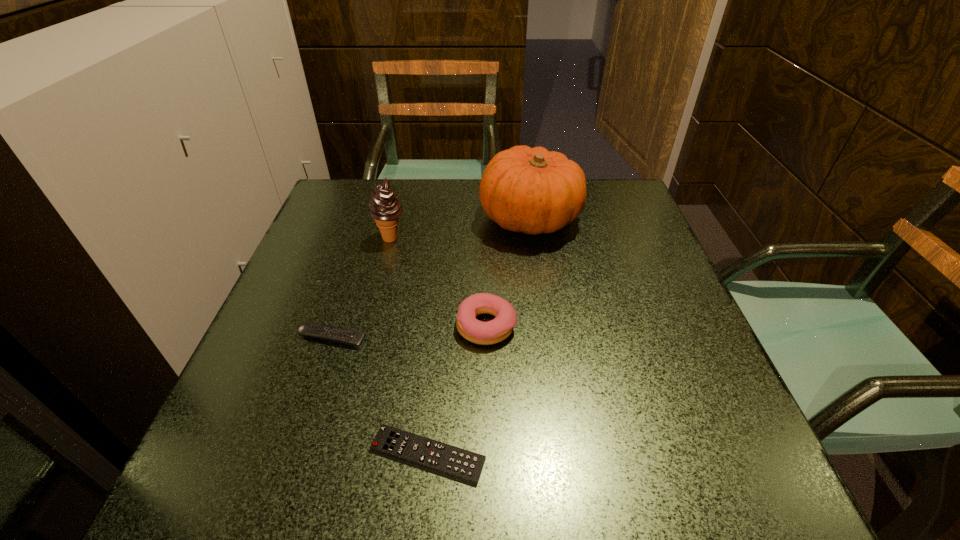
You are a GUI agent. You are given a task and a screenshot of the screen. Output one action in this format:
    pyautogui.click(x=<x>, y=<y>)
    Task: Click on the pumpkin
    This screenshot has width=960, height=540.
    Given the screenshot: What is the action you would take?
    tap(531, 190)

At what (x,y) coordinates should I click in order to perform the action: click on icecream. Please return your answer as a coordinate pair (x, y). Looking at the image, I should click on (385, 207).

At what (x,y) coordinates should I click in order to perform the action: click on the third shortest object. Please return your answer as a coordinate pair (x, y). The height and width of the screenshot is (540, 960). Looking at the image, I should click on (491, 332).

Where is `the second shortest object`? The image size is (960, 540). the second shortest object is located at coordinates (353, 338).

Identify the location of the left remote control. The height and width of the screenshot is (540, 960). (353, 338).

I want to click on the nearest object, so click(443, 458).

Locate an element on the screen. the right remote control is located at coordinates (443, 458).

In order to click on vacant space located 0.390m on the left of the pumpkin in this screenshot , I will do `click(325, 219)`.

You are a GUI agent. You are given a task and a screenshot of the screen. Output one action in this format:
    pyautogui.click(x=<x>, y=<y>)
    Task: Click on the free spot located on the right of the icecream
    This screenshot has width=960, height=540.
    Given the screenshot: What is the action you would take?
    click(540, 238)

Where is `vacant space situated 0.180m on the front of the doughnut`? This screenshot has width=960, height=540. vacant space situated 0.180m on the front of the doughnut is located at coordinates (488, 442).